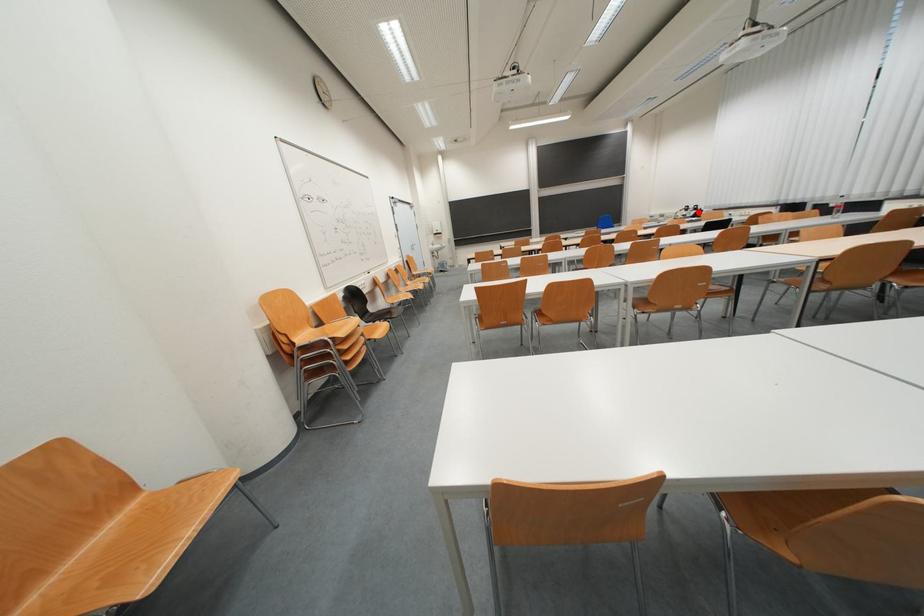
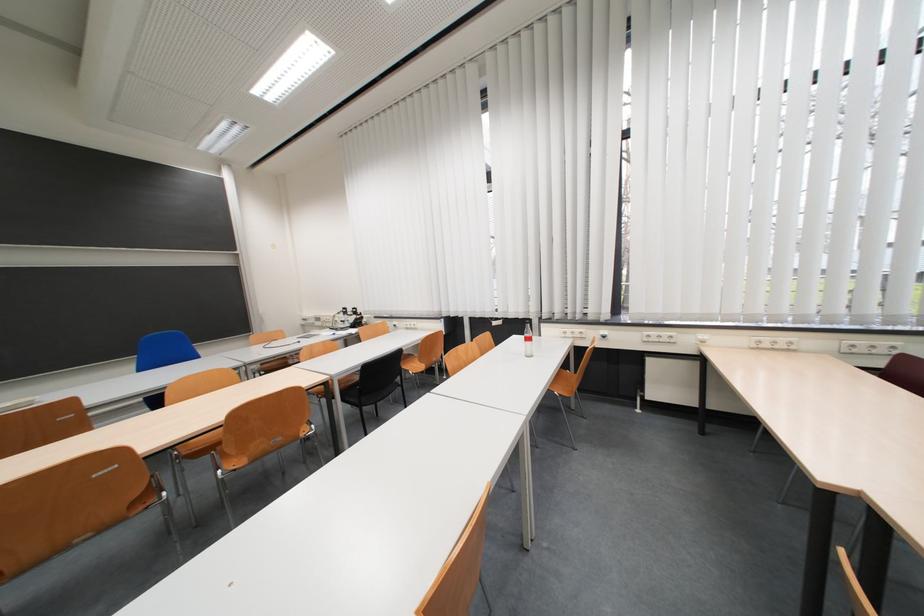
Question: A red point is marked in image1. In image2, is the corresponding 3D point closer to the camera or farther? Reply with the corresponding letter.

Choices:
 (A) The corresponding 3D point is closer.
 (B) The corresponding 3D point is farther.

Answer: (B)